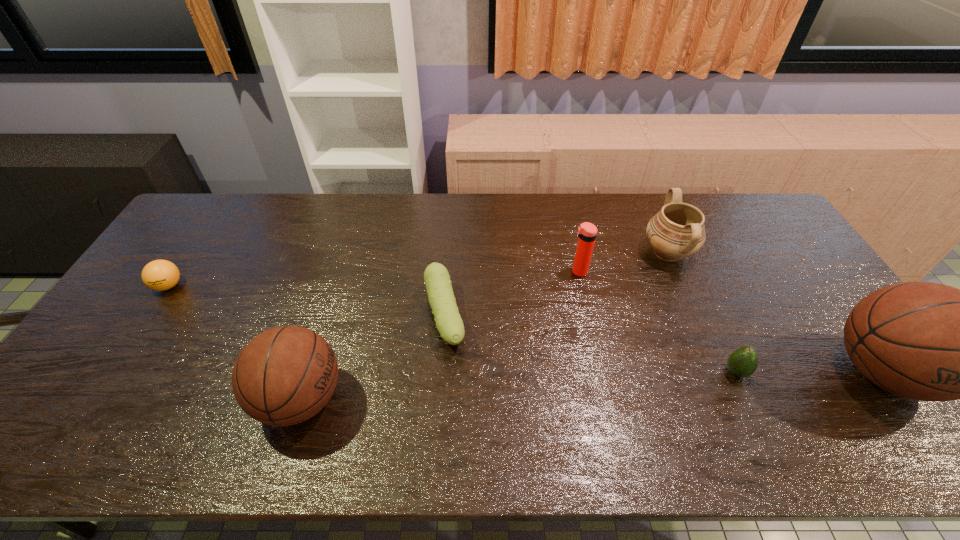
You are a GUI agent. You are given a task and a screenshot of the screen. Output one action in this format:
    pyautogui.click(x=<x>, y=<y>)
    Task: Click on the free space at the near edge
    Image resolution: width=960 pixels, height=540 pixels.
    Given the screenshot: What is the action you would take?
    pyautogui.click(x=151, y=386)

In the image, there is a desktop. What are the coordinates of `vacant space at the left edge` in the screenshot? It's located at (152, 300).

The height and width of the screenshot is (540, 960). In the image, there is a desktop. Identify the location of vacant space at the right edge. (768, 250).

In the image, there is a desktop. In order to click on vacant space at the far left corner in this screenshot , I will do `click(212, 200)`.

Find the location of a particular element. The image size is (960, 540). free space at the near left corner is located at coordinates (82, 407).

The width and height of the screenshot is (960, 540). In the image, there is a desktop. Find the location of `free space at the far right corner`. free space at the far right corner is located at coordinates (718, 200).

This screenshot has height=540, width=960. Identify the location of unoccupied area between the left basketball and the third object from left to right. tap(372, 358).

Locate an element on the screen. free space between the fourth object from left to right and the third object from left to right is located at coordinates (512, 294).

Identify the location of vacant space in between the thermos bottle and the avocado. (658, 322).

Locate an element on the screen. vacant area that lies between the leftmost object and the second object from left to right is located at coordinates (235, 342).